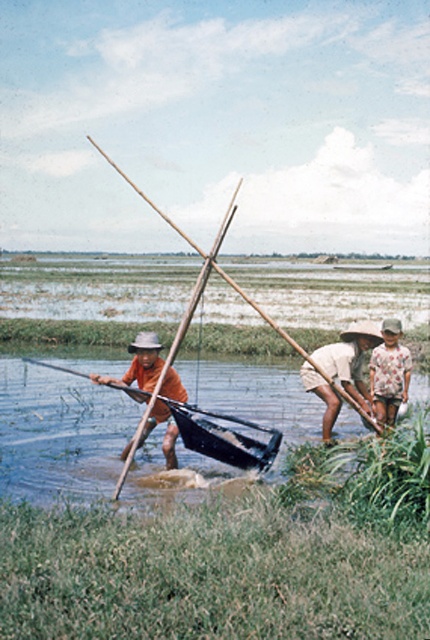
Between white cotton shirt at lower right and orange fabric hat at left, which one is positioned lower?

orange fabric hat at left is lower down.

Who is more forward, (358,330) or (153,406)?

Point (153,406) is more forward.

Find the location of a particular element. The image size is (430, 640). white cotton shirt at lower right is located at coordinates point(340,371).

Can you confirm if floral fabric shirt at lower right is thinner than wooden stick at center?

Indeed, floral fabric shirt at lower right has a lesser width compared to wooden stick at center.

How much distance is there between floral fabric shirt at lower right and wooden stick at center?

They are 34.38 feet apart.

Describe the element at coordinates (389, 372) in the screenshot. I see `floral fabric shirt at lower right` at that location.

Image resolution: width=430 pixels, height=640 pixels. I want to click on floral fabric shirt at lower right, so click(x=389, y=372).

Looking at this image, which is more to the left, white cotton shirt at lower right or floral fabric shirt at lower right?

white cotton shirt at lower right is more to the left.

Is point (335, 406) positioned before point (380, 378)?

That is True.

This screenshot has width=430, height=640. In order to click on white cotton shirt at lower right in this screenshot , I will do `click(340, 371)`.